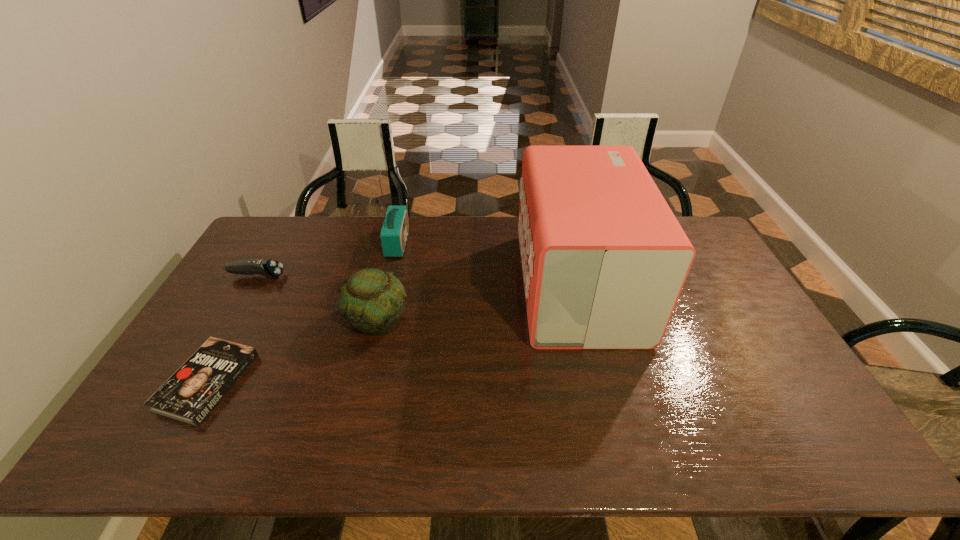
Where is `free region at the left edge of the desktop`? This screenshot has width=960, height=540. free region at the left edge of the desktop is located at coordinates (232, 303).

Locate an element on the screen. This screenshot has width=960, height=540. vacant space at the right edge is located at coordinates (784, 375).

Identify the location of free location at the far right corner of the desktop. (695, 233).

Locate an element on the screen. The image size is (960, 540). vacant area that lies between the radio receiver and the book is located at coordinates (302, 312).

I want to click on vacant area that lies between the fourth shortest object and the electric shaver, so click(x=327, y=259).

The image size is (960, 540). I want to click on vacant region between the electric shaver and the fourth shortest object, so click(327, 259).

Find the location of a particular element. Image resolution: width=960 pixels, height=540 pixels. unoccupied area between the electric shaver and the pottery is located at coordinates (318, 298).

At what (x,y) coordinates should I click in order to perform the action: click on vacant area between the third tallest object and the box. Please return your answer as a coordinate pair (x, y). Looking at the image, I should click on (478, 302).

Identify the location of vacant point located between the box and the pottery. This screenshot has height=540, width=960. pyautogui.click(x=478, y=302).

Locate an element on the screen. free spot between the pottery and the electric shaver is located at coordinates (318, 298).